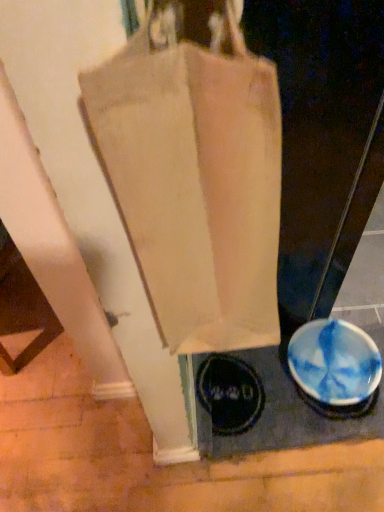
Question: Based on their sizes in the image, would you say canvas bag at center is bigger or smaller than blue glossy bowl at lower right?

Choices:
 (A) small
 (B) big

Answer: (B)

Question: Considering the positions of point (180, 285) and point (375, 370), is point (180, 285) closer or farther from the camera than point (375, 370)?

Choices:
 (A) closer
 (B) farther

Answer: (A)

Question: From the image's perspective, is canvas bag at center above or below blue glossy bowl at lower right?

Choices:
 (A) above
 (B) below

Answer: (A)

Question: Which is correct: blue glossy bowl at lower right is inside canvas bag at center, or outside of it?

Choices:
 (A) inside
 (B) outside

Answer: (B)

Question: Looking at their shapes, would you say blue glossy bowl at lower right is wider or thinner than canvas bag at center?

Choices:
 (A) thin
 (B) wide

Answer: (B)

Question: From their relative heights in the image, would you say blue glossy bowl at lower right is taller or shorter than canvas bag at center?

Choices:
 (A) short
 (B) tall

Answer: (A)

Question: Based on their positions, is blue glossy bowl at lower right located to the left or right of canvas bag at center?

Choices:
 (A) left
 (B) right

Answer: (B)